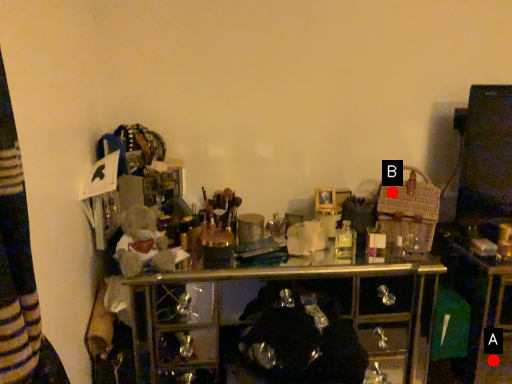
Question: Two points are circled on the image, labeled by A and B beside each circle. Which point is closer to the camera?

Choices:
 (A) A is closer
 (B) B is closer

Answer: (B)